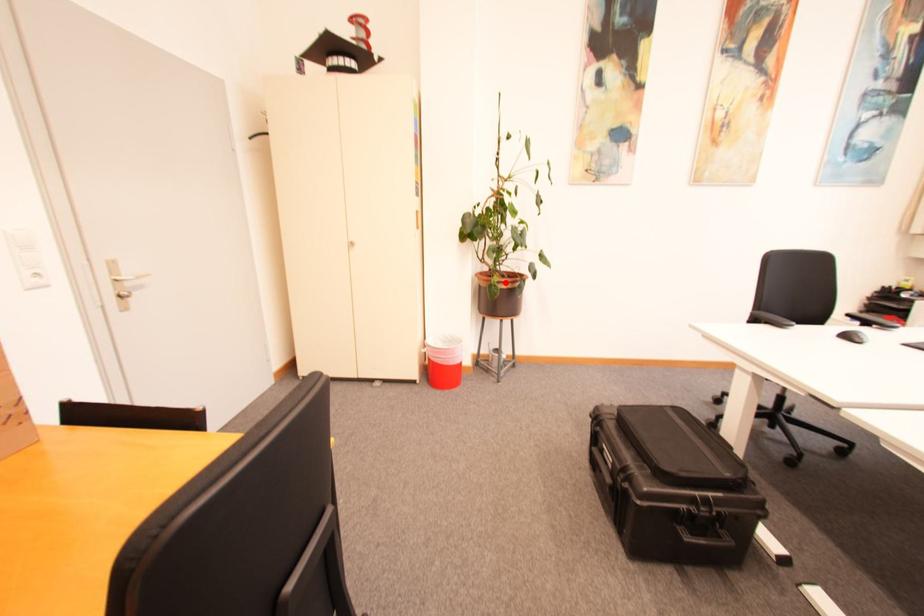
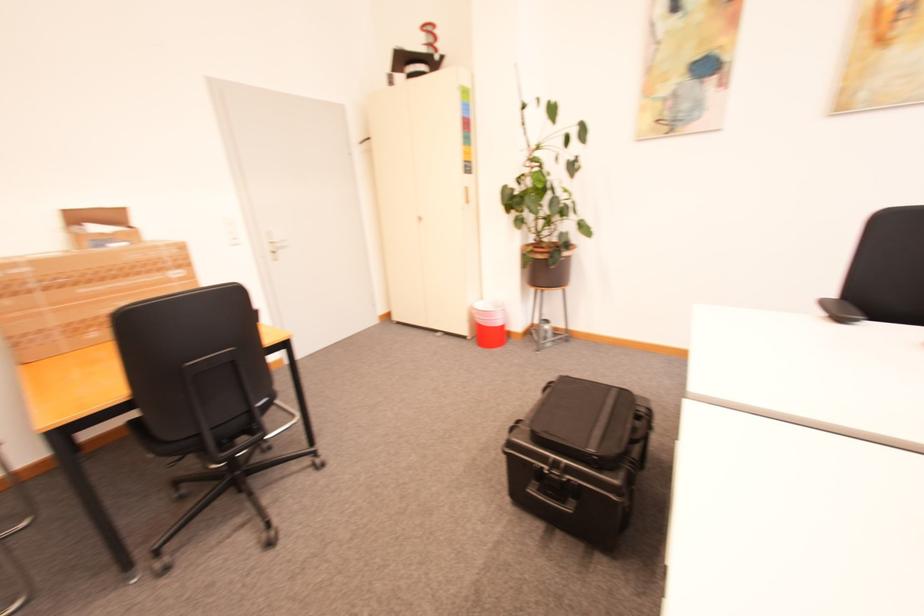
Find the pixel in the second image that matches the highlighted location in the first image.

(539, 253)